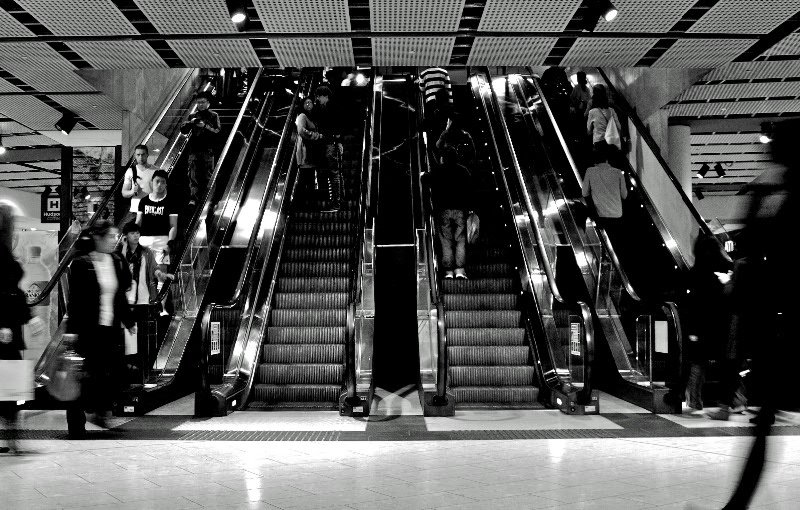
Image resolution: width=800 pixels, height=510 pixels. What are the coordinates of `floor` in the screenshot? It's located at (293, 478).